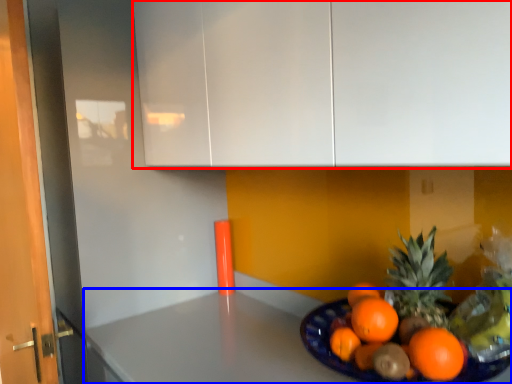
Question: Among these objects, which one is nearest to the camera, cabinetry (highlighted by a red box) or counter top (highlighted by a blue box)?

Choices:
 (A) cabinetry
 (B) counter top

Answer: (A)